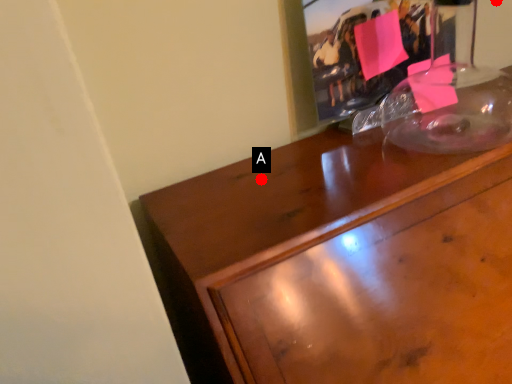
Question: Two points are circled on the image, labeled by A and B beside each circle. Which of the following is the closest to the observer?

Choices:
 (A) A is closer
 (B) B is closer

Answer: (A)